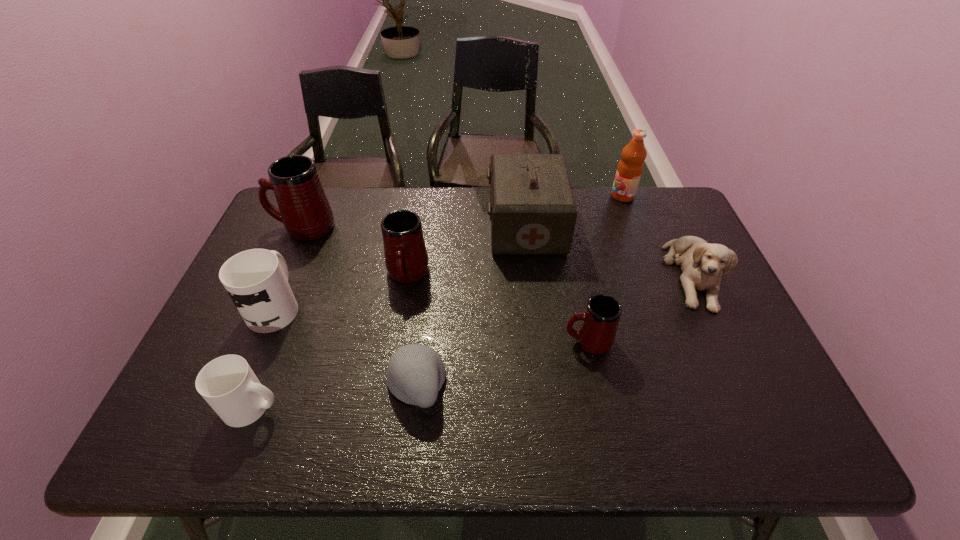
Identify the location of mug present at the far edge. (304, 209).

The width and height of the screenshot is (960, 540). I want to click on the first-aid kit that is at the far edge, so click(532, 209).

In order to click on mug present at the near edge in this screenshot , I will do `click(228, 384)`.

Where is `beanie at the near edge`? beanie at the near edge is located at coordinates (415, 374).

I want to click on fruit juice at the right edge, so pos(630,167).

Where is `puppy that is at the right edge`? This screenshot has width=960, height=540. puppy that is at the right edge is located at coordinates (702, 263).

Find the location of `object that is positioned at the far left corner`. object that is positioned at the far left corner is located at coordinates (304, 209).

Where is `object at the near left corner`? object at the near left corner is located at coordinates (228, 384).

What are the coordinates of `object that is at the far right corner` in the screenshot? It's located at (630, 167).

Find the location of a particular element. The height and width of the screenshot is (540, 960). vacant space at the far edge of the desktop is located at coordinates (426, 186).